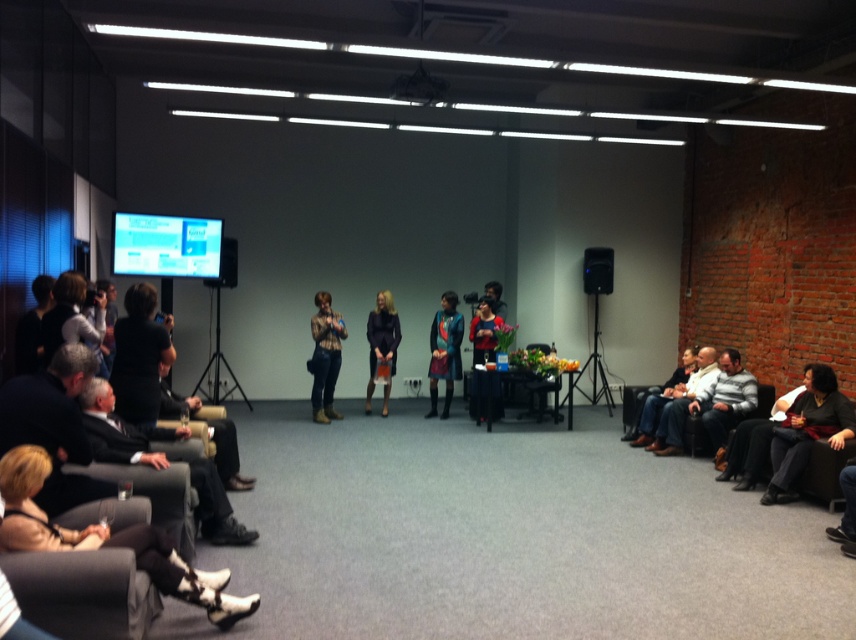
Question: Is wooden chair at center wider than black plastic speaker at right?

Choices:
 (A) no
 (B) yes

Answer: (B)

Question: Which object is farther from the camera taking this photo?

Choices:
 (A) black plastic speaker at right
 (B) blue wool coat at center
 (C) matte black dress at center

Answer: (A)

Question: Does dark gray fabric chair at lower left appear over black plastic speaker at right?

Choices:
 (A) no
 (B) yes

Answer: (A)

Question: Considering the real-world distances, which object is closest to the black plastic speaker at right?

Choices:
 (A) matte black dress at center
 (B) matte black speaker at center

Answer: (A)

Question: Is dark gray fabric chair at lower left bigger than wooden chair at center?

Choices:
 (A) no
 (B) yes

Answer: (B)

Question: Considering the real-world distances, which object is farthest from the matte black dress at center?

Choices:
 (A) blue wool coat at center
 (B) white socks at lower left

Answer: (B)